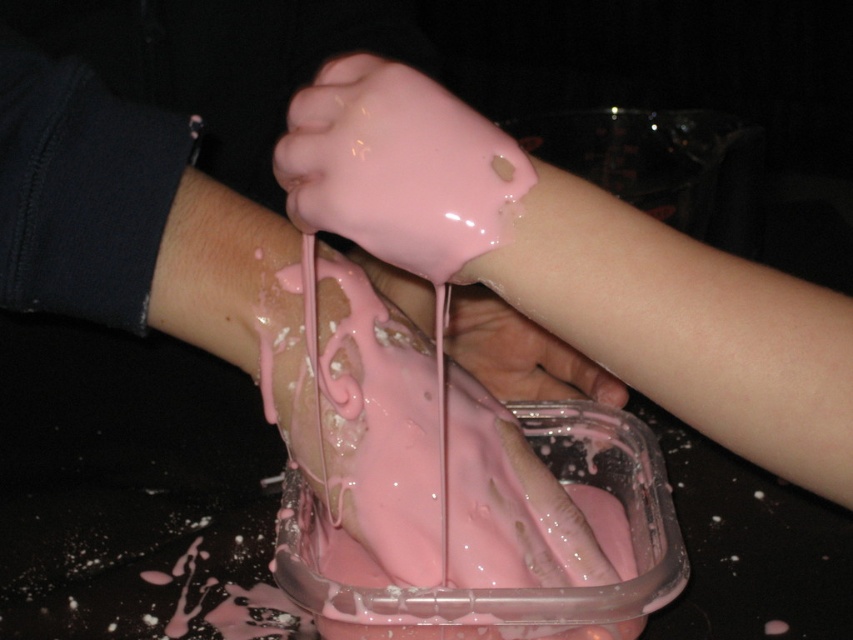
You are a baker trying to measure the pink glossy frosting at center and the pink glossy hand at center. Which object has a larger volume?

The pink glossy frosting at center has a larger volume than the pink glossy hand at center according to the description.

You are a chef trying to prepare a cake decoration. You have a pink glossy hand at center holding some pink glossy frosting at center. To ensure the frosting doesn t drip onto the table, where should you position your hand relative to the frosting?

The pink glossy frosting at center is positioned under the pink glossy hand at center, so to prevent dripping, the hand should be placed above the frosting instead of below it.